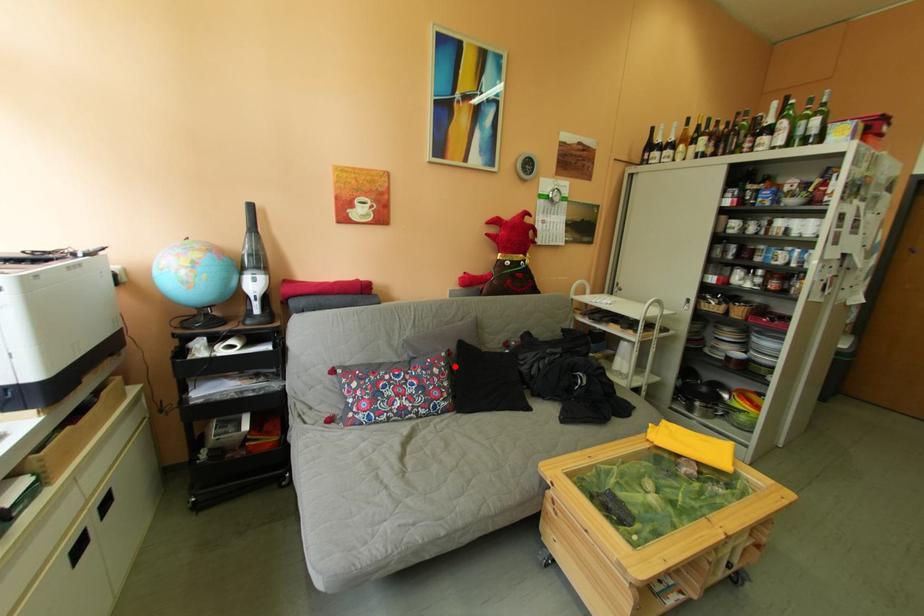
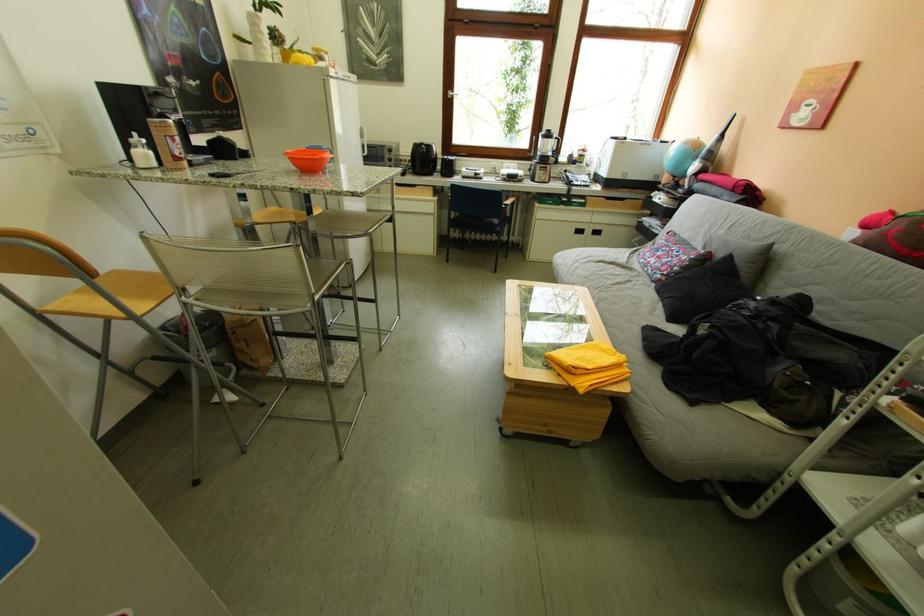
Question: I am providing you with two images of the same scene from different viewpoints. Given a red point in image1, look at the same physical point in image2. Is it:

Choices:
 (A) Closer to the viewpoint
 (B) Farther from the viewpoint

Answer: (A)